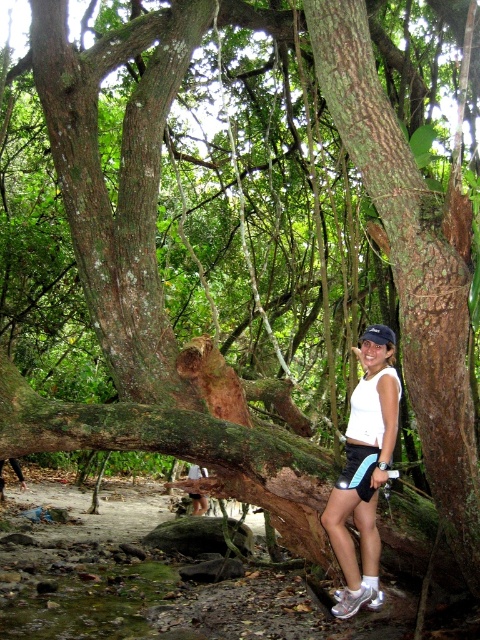
Question: Which point is closer to the camera?

Choices:
 (A) (372, 429)
 (B) (427, 360)

Answer: (B)

Question: Among these objects, which one is farthest from the camera?

Choices:
 (A) white matte shorts at center
 (B) brown rough tree trunk at center

Answer: (A)

Question: Does brown rough tree trunk at center have a smaller size compared to white matte shorts at center?

Choices:
 (A) no
 (B) yes

Answer: (A)

Question: Can you confirm if brown rough tree trunk at center is positioned below white matte shorts at center?

Choices:
 (A) no
 (B) yes

Answer: (A)

Question: Can you confirm if brown rough tree trunk at center is wider than white matte shorts at center?

Choices:
 (A) yes
 (B) no

Answer: (A)